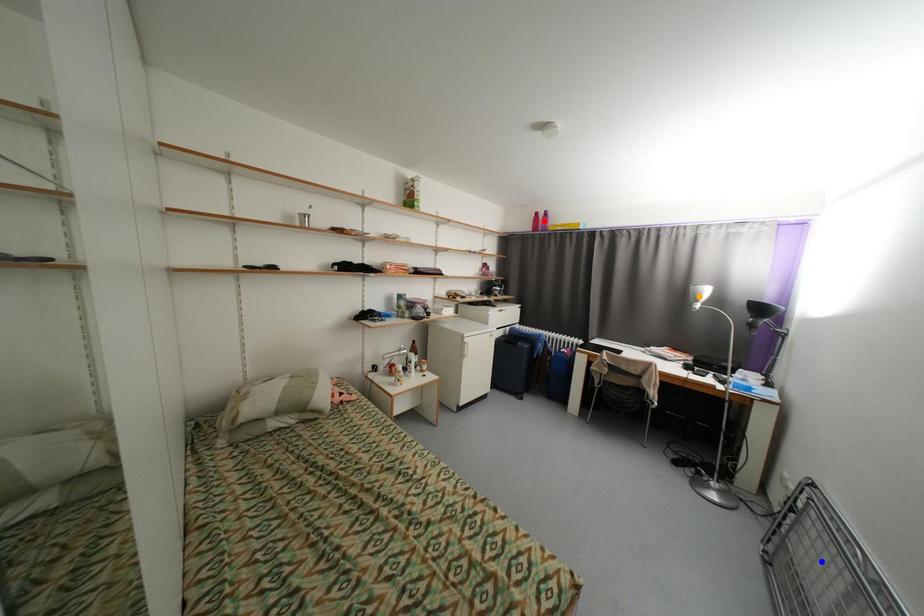
Order these from nearest to farthest:
red point
blue point
orange point

blue point < orange point < red point